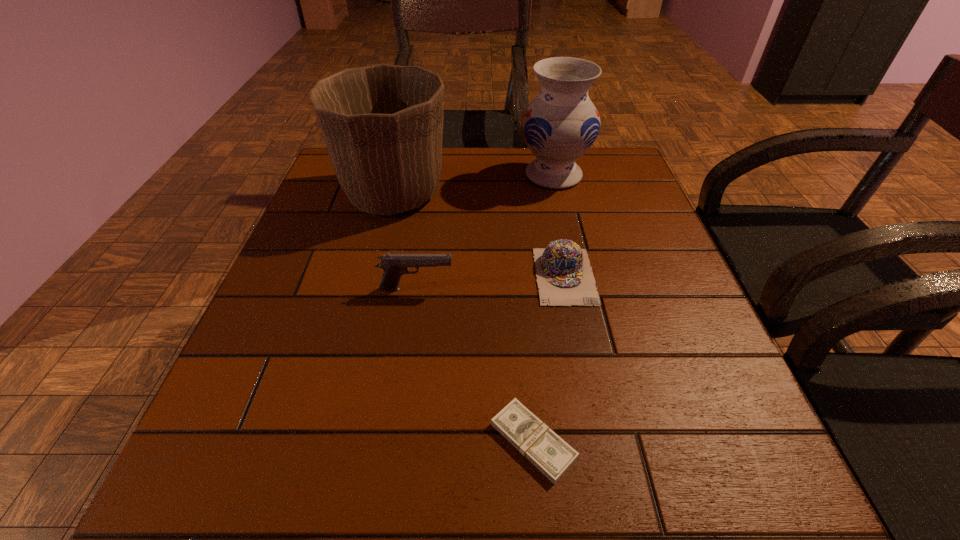
Where is `vacant region between the cap and the shortest object`? vacant region between the cap and the shortest object is located at coordinates (549, 359).

At what (x,y) coordinates should I click in order to perform the action: click on free spot between the nearest object and the pistol. Please return your answer as a coordinate pair (x, y). Looking at the image, I should click on (475, 365).

This screenshot has height=540, width=960. I want to click on free space between the money and the second shortest object, so click(x=549, y=359).

What are the coordinates of `vacant space that is in between the flowerpot and the shortest object` in the screenshot? It's located at (464, 318).

This screenshot has height=540, width=960. Find the location of `vacant region between the vase and the money`. vacant region between the vase and the money is located at coordinates (543, 308).

Image resolution: width=960 pixels, height=540 pixels. I want to click on object identified as the fourth closest to the shortest object, so click(560, 124).

I want to click on the fourth closest object to the vase, so click(549, 453).

Where is `vacant area in the image that satisfies the following two spatial constraints: 1. at the barrel of the shortest object; 2. on the right side of the pistol`? Image resolution: width=960 pixels, height=540 pixels. vacant area in the image that satisfies the following two spatial constraints: 1. at the barrel of the shortest object; 2. on the right side of the pistol is located at coordinates pos(395,441).

Locate an element on the screen. free space in the image that satisfies the following two spatial constraints: 1. at the barrel of the third tallest object; 2. on the back side of the nearest object is located at coordinates (395, 441).

Image resolution: width=960 pixels, height=540 pixels. I want to click on free space that satisfies the following two spatial constraints: 1. on the front, side, and top of the second shortest object; 2. at the barrel of the third shortest object, so click(x=567, y=289).